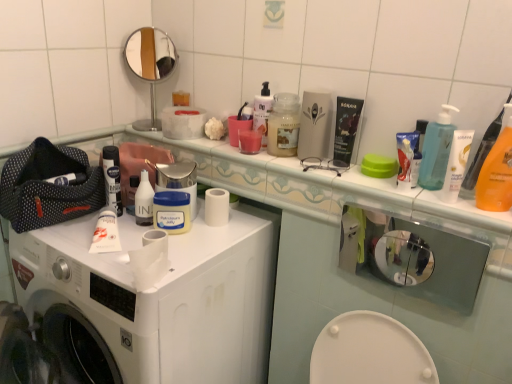
I want to click on free space in front of white matte tube at center, so click(95, 259).